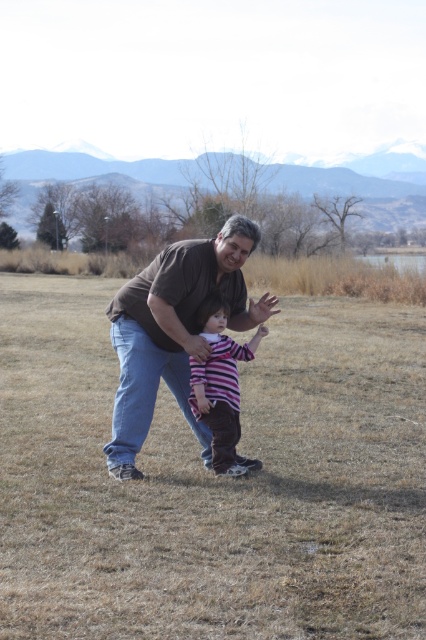
Is brown cotton shirt at center below striped cotton shirt at center?

Incorrect, brown cotton shirt at center is not positioned below striped cotton shirt at center.

Does brown cotton shirt at center come in front of striped cotton shirt at center?

Yes, brown cotton shirt at center is in front of striped cotton shirt at center.

Between point (147, 390) and point (244, 468), which one is positioned behind?

Positioned behind is point (244, 468).

This screenshot has height=640, width=426. I want to click on brown cotton shirt at center, so click(173, 332).

Is point (23, 344) less distant than point (209, 413)?

No, it is not.

Is brown dry grass at center to the right of striped cotton shirt at center from the viewer's perspective?

In fact, brown dry grass at center is to the left of striped cotton shirt at center.

At what (x,y) coordinates should I click in order to perform the action: click on brown dry grass at center. Please return your answer as a coordinate pair (x, y). Looking at the image, I should click on (213, 481).

Based on the photo, which of these two, brown dry grass at center or brown cotton shirt at center, stands taller?

brown cotton shirt at center

Is brown dry grass at center closer to the viewer compared to brown cotton shirt at center?

Yes, it is.

Where is `brown dry grass at center`? brown dry grass at center is located at coordinates (213, 481).

Locate an element on the screen. The image size is (426, 640). brown dry grass at center is located at coordinates (213, 481).